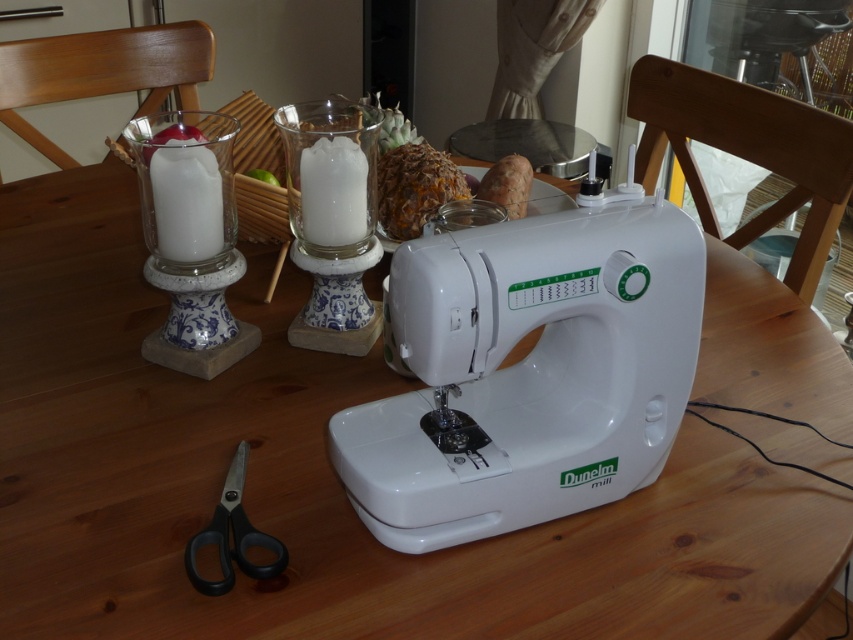
Between white plastic sewing machine at center and white ceramic candle holder at left, which one appears on the right side from the viewer's perspective?

Positioned to the right is white plastic sewing machine at center.

Is white plastic sewing machine at center thinner than white ceramic candle holder at left?

No, white plastic sewing machine at center is not thinner than white ceramic candle holder at left.

Does point (430, 515) lie behind point (144, 124)?

No.

Identify the location of white plastic sewing machine at center. (527, 371).

From the picture: Does white glass candle holder at center have a lesser height compared to black plastic scissors at lower left?

No, white glass candle holder at center is not shorter than black plastic scissors at lower left.

Is white glass candle holder at center to the right of black plastic scissors at lower left from the viewer's perspective?

Indeed, white glass candle holder at center is positioned on the right side of black plastic scissors at lower left.

At what (x,y) coordinates should I click in order to perform the action: click on white glass candle holder at center. Please return your answer as a coordinate pair (x, y). Image resolution: width=853 pixels, height=640 pixels. Looking at the image, I should click on (332, 220).

Can you confirm if white ceramic candle holder at left is thinner than black plastic scissors at lower left?

No, white ceramic candle holder at left is not thinner than black plastic scissors at lower left.

Between white ceramic candle holder at left and black plastic scissors at lower left, which one is positioned higher?

Positioned higher is white ceramic candle holder at left.

Locate an element on the screen. The width and height of the screenshot is (853, 640). white ceramic candle holder at left is located at coordinates (190, 236).